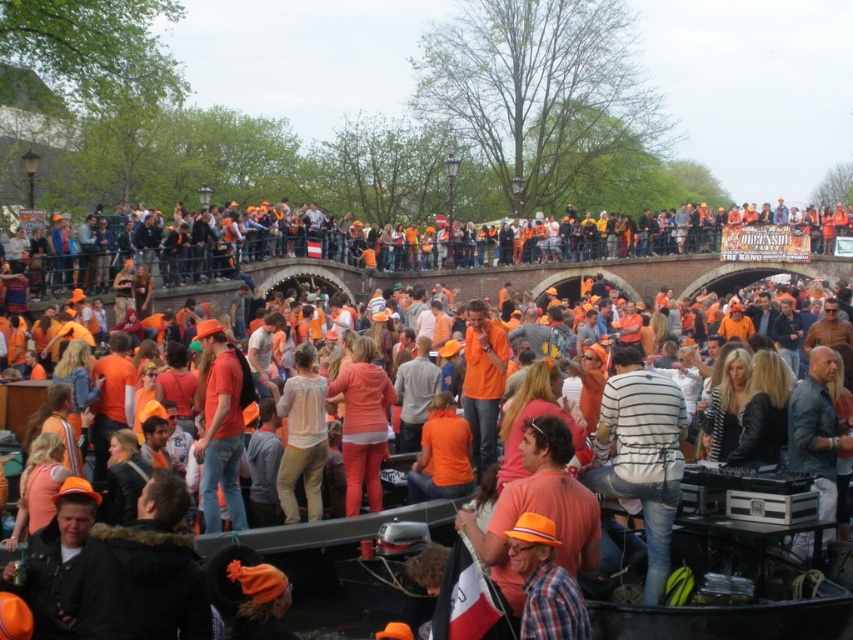
Is matte orange shirt at center to the right of plaid fabric hat at center from the viewer's perspective?

In fact, matte orange shirt at center is to the left of plaid fabric hat at center.

Who is positioned more to the right, matte orange shirt at center or plaid fabric hat at center?

plaid fabric hat at center is more to the right.

Who is more distant from viewer, (335, 401) or (549, 589)?

The point (335, 401) is more distant.

You are a GUI agent. You are given a task and a screenshot of the screen. Output one action in this format:
    pyautogui.click(x=<x>, y=<y>)
    Task: Click on the matte orange shirt at center
    This screenshot has width=853, height=640.
    Given the screenshot: What is the action you would take?
    pyautogui.click(x=363, y=422)